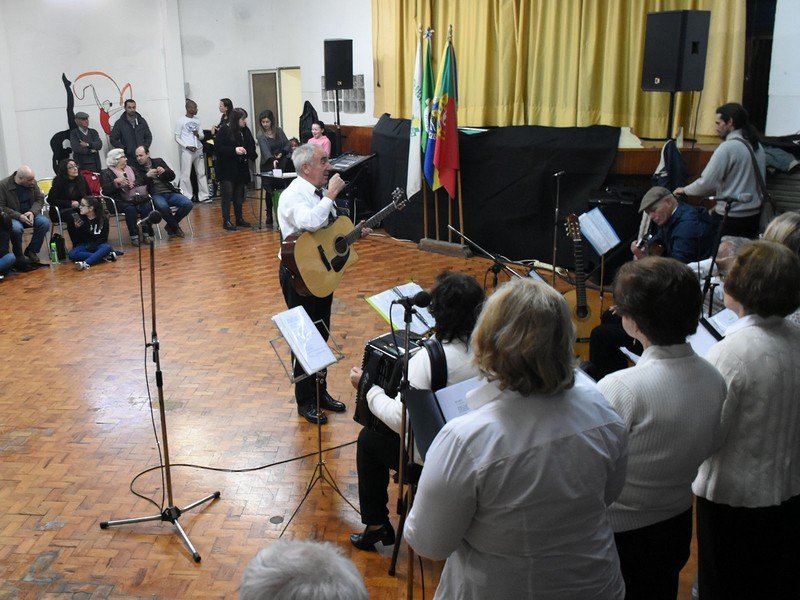
Find the location of a particular element. music stand is located at coordinates (292, 369), (333, 338), (601, 263).